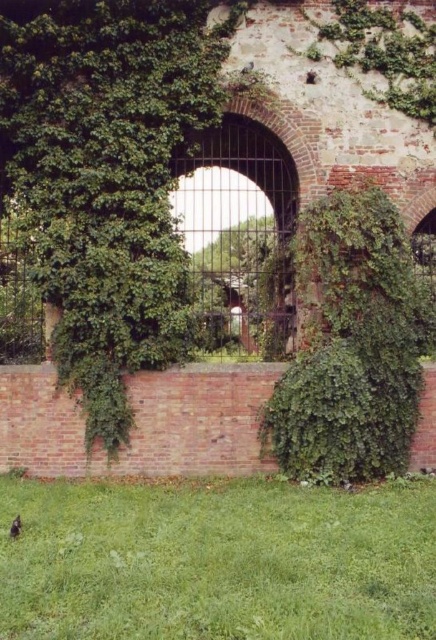
You are a small cat sitting on the ground in front of the old brick wall. You see the green leafy ivy at center and the shiny black bird at lower left. Which object is closer to the ground?

The shiny black bird at lower left is closer to the ground because it is much shorter than the green leafy ivy at center.